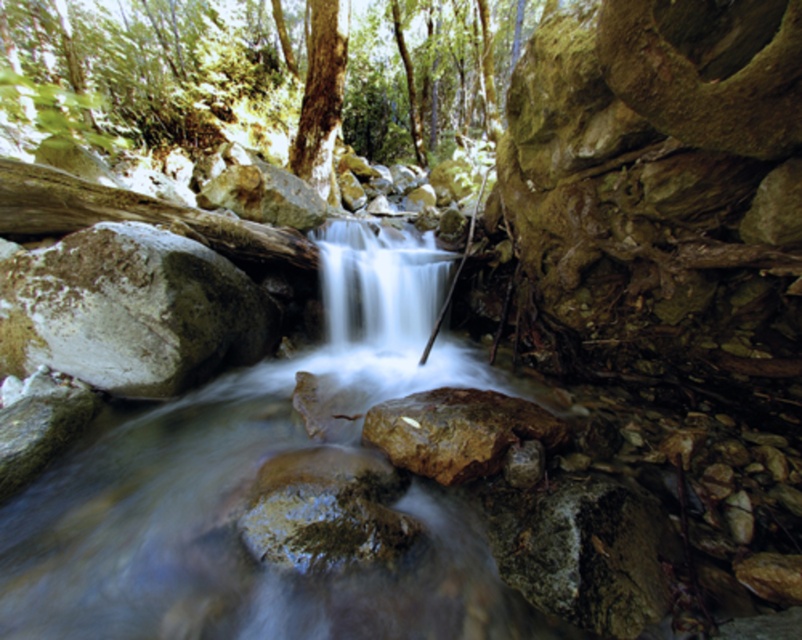
Is white smooth waterfall at center to the right of brown rough rock at center from the viewer's perspective?

In fact, white smooth waterfall at center is to the left of brown rough rock at center.

Does point (399, 260) lie in front of point (489, 397)?

No, (399, 260) is behind (489, 397).

Is point (424, 284) positioned behind point (485, 396)?

Yes, it is.

Identify the location of white smooth waterfall at center. (379, 284).

Is point (94, 291) more distant than point (310, 68)?

No, it is in front of (310, 68).

Who is more distant from viewer, (107, 378) or (323, 138)?

Point (323, 138)

Is point (87, 333) closer to viewer compared to point (335, 24)?

Yes, it is in front of point (335, 24).

Locate an element on the screen. brown rough rock at left is located at coordinates (130, 310).

Does white smooth waterfall at center appear under smooth bark tree at center?

Yes, white smooth waterfall at center is below smooth bark tree at center.

In the scene shown: Who is positioned more to the right, white smooth waterfall at center or smooth bark tree at center?

Positioned to the right is white smooth waterfall at center.

Between point (402, 260) and point (329, 148), which one is positioned behind?

Positioned behind is point (329, 148).

Find the location of a particular element. This screenshot has width=802, height=640. white smooth waterfall at center is located at coordinates click(379, 284).